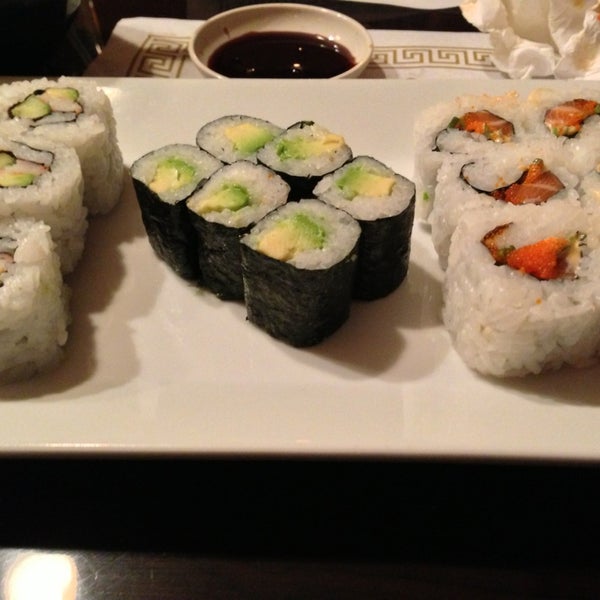
Locate an element on the screen. The image size is (600, 600). bowl is located at coordinates (321, 15).